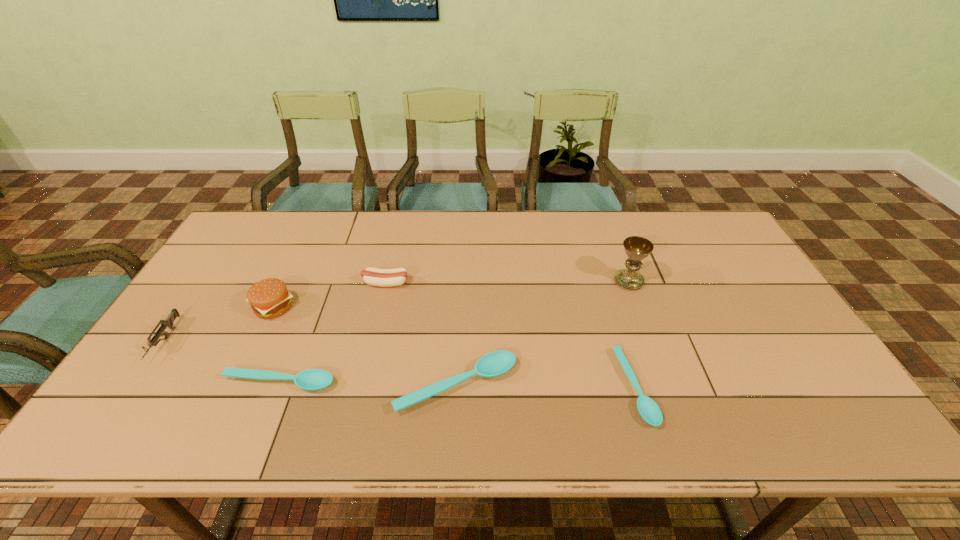
What are the coordinates of `vacant space that is in between the fifth object from left to right and the rightmost object` in the screenshot? It's located at (542, 333).

Where is `vacant area that lies between the gun and the second spoon from left to right`? The height and width of the screenshot is (540, 960). vacant area that lies between the gun and the second spoon from left to right is located at coordinates (311, 363).

The width and height of the screenshot is (960, 540). Find the location of `unoccupied area between the second spoon from left to right and the sausage`. unoccupied area between the second spoon from left to right and the sausage is located at coordinates (421, 334).

I want to click on object that is the fourth closest one to the second spoon from right to left, so click(x=269, y=298).

Choose which object is the sixth nearest neighbor to the rightmost spoon. Please provide its 2D coordinates. Your answer should be formatted as a tuple, i.e. [(x, y)], where the tuple contains the x and y coordinates of a point satisfying the conditions above.

[(168, 322)]

You are a GUI agent. You are given a task and a screenshot of the screen. Output one action in this format:
    pyautogui.click(x=<x>, y=<y>)
    Task: Click on the spoon that stands as the second closest to the second shortest spoon
    
    Given the screenshot: What is the action you would take?
    pyautogui.click(x=650, y=412)

Identify the location of spoon identified as the second closest to the chalice. (494, 364).

Find the location of a particular element. The image size is (960, 540). free space that satisfies the following two spatial constraints: 1. aimed along the barrel of the leftmost object; 2. on the right side of the third object from right to left is located at coordinates (134, 386).

I want to click on free space that satisfies the following two spatial constraints: 1. on the back side of the sausage; 2. on the left side of the sixth tallest object, so 319,283.